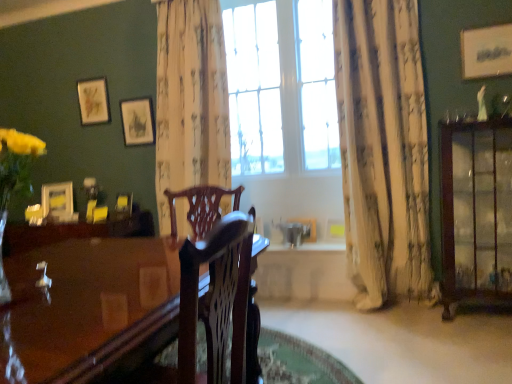
Question: Relative to yellow paper picture frame at center, which appears as the 2th picture frame when viewed from the front, is white paper at upper right, marked as the 6th picture frame in a back-to-front arrangement, in front or behind?

Choices:
 (A) front
 (B) behind

Answer: (A)

Question: Is white paper at upper right, which is counted as the 1th picture frame, starting from the right, spatially inside yellow paper picture frame at center, marked as the 5th picture frame in a back-to-front arrangement, or outside of it?

Choices:
 (A) inside
 (B) outside

Answer: (B)

Question: Estimate the real-world distances between objects in this image. Which object is farther from the brown wood cabinet at right?

Choices:
 (A) matte yellow picture frame at left, which is the sixth picture frame from right to left
 (B) glossy wood table at center
 (C) mahogany wood chair at center
 (D) wooden picture frame at center, acting as the fourth picture frame starting from the left
 (E) clear glass window at center

Answer: (A)

Question: Which object is positioned farthest from the brown wood cabinet at right?

Choices:
 (A) yellow paper picture frame at center, which appears as the 2th picture frame when viewed from the front
 (B) clear glass window at center
 (C) matte white picture frame at upper center, which is the third picture frame in top-to-bottom order
 (D) glossy wood table at center
 (E) white floral fabric curtain at center, placed as the first curtain when sorted from left to right

Answer: (C)